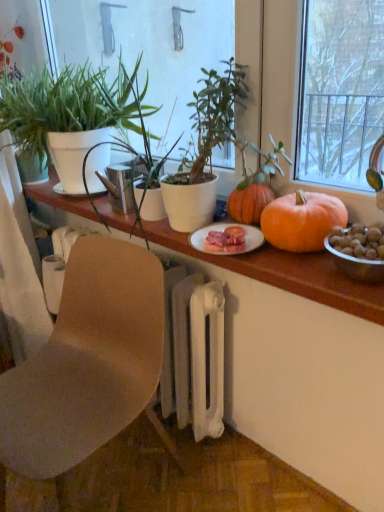
Question: From the image's perspective, does orange matte pumpkin at center appear higher than green matte plant at left, positioned as the 2th houseplant in right-to-left order?

Choices:
 (A) no
 (B) yes

Answer: (A)

Question: Is green matte plant at left, acting as the 1th houseplant starting from the left, located within orange matte pumpkin at center?

Choices:
 (A) yes
 (B) no

Answer: (B)

Question: Is orange matte pumpkin at center at the right side of green matte plant at left, acting as the 1th houseplant starting from the left?

Choices:
 (A) yes
 (B) no

Answer: (A)

Question: Is orange matte pumpkin at center shorter than green matte plant at left, positioned as the 2th houseplant in right-to-left order?

Choices:
 (A) yes
 (B) no

Answer: (A)

Question: From a real-world perspective, is orange matte pumpkin at center beneath green matte plant at left, positioned as the 2th houseplant in right-to-left order?

Choices:
 (A) yes
 (B) no

Answer: (A)

Question: From a real-world perspective, is orange matte pumpkin at center on top of green matte plant at left, acting as the 1th houseplant starting from the left?

Choices:
 (A) yes
 (B) no

Answer: (B)

Question: From a real-world perspective, does orange matte pumpkin at center stand above brown matte chair at lower left?

Choices:
 (A) no
 (B) yes

Answer: (B)

Question: Does orange matte pumpkin at center have a larger size compared to brown matte chair at lower left?

Choices:
 (A) no
 (B) yes

Answer: (A)

Question: Is orange matte pumpkin at center aimed at brown matte chair at lower left?

Choices:
 (A) no
 (B) yes

Answer: (A)

Question: Is brown matte chair at lower left at the back of orange matte pumpkin at center?

Choices:
 (A) yes
 (B) no

Answer: (B)

Question: Is orange matte pumpkin at center thinner than brown matte chair at lower left?

Choices:
 (A) yes
 (B) no

Answer: (A)

Question: Is orange matte pumpkin at center placed right next to brown matte chair at lower left?

Choices:
 (A) no
 (B) yes

Answer: (A)

Question: Could you tell me if green matte plant at left, positioned as the 2th houseplant in right-to-left order, is facing green matte plant at center, the 2th houseplant in the left-to-right sequence?

Choices:
 (A) no
 (B) yes

Answer: (A)